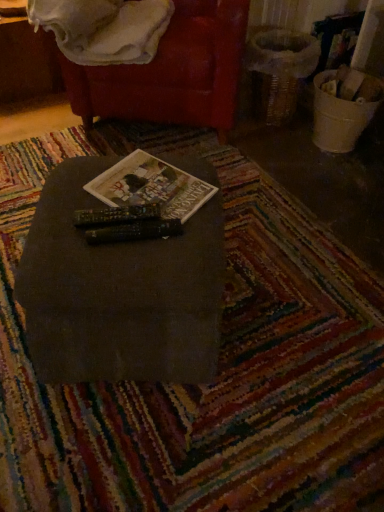
At what (x,y) coordinates should I click in order to perform the action: click on free space to the right of matte black table at center. Please return your answer as a coordinate pair (x, y). Looking at the image, I should click on (294, 317).